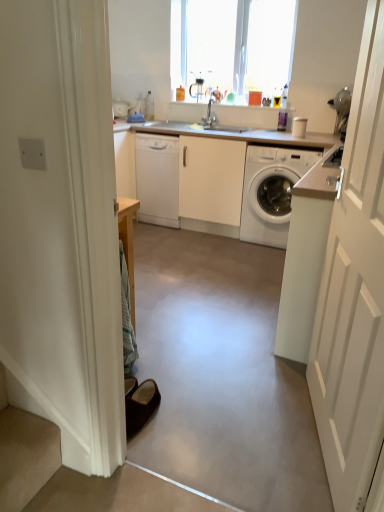
You are a GUI agent. You are given a task and a screenshot of the screen. Output one action in this format:
    pyautogui.click(x=<x>, y=<y>)
    Task: Click on the vacant space to the right of brown suede slippers at lower left
    The image size is (384, 512).
    Given the screenshot: What is the action you would take?
    pyautogui.click(x=189, y=417)